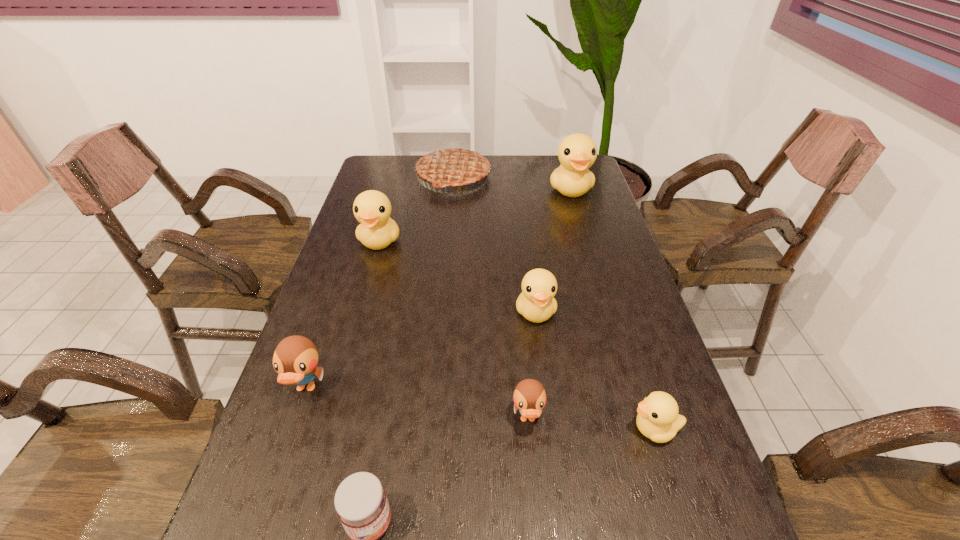
Find the location of `empty space between the second farthest duck and the smaller blue duck`. empty space between the second farthest duck and the smaller blue duck is located at coordinates (454, 330).

Locate an element on the screen. Image resolution: width=960 pixels, height=540 pixels. unoccupied area between the second nearest yellow duck and the nearest yellow duck is located at coordinates point(595,370).

Where is `vacant space that's between the third smallest yellow duck and the smallest yellow duck`? The width and height of the screenshot is (960, 540). vacant space that's between the third smallest yellow duck and the smallest yellow duck is located at coordinates point(517,335).

Find the location of `object that is the fourth nearest to the pie`. object that is the fourth nearest to the pie is located at coordinates (295, 359).

I want to click on object identified as the seventh closest to the right blue duck, so click(x=455, y=165).

Locate which duck ranks fifth in proximity to the red jam. Please provide its 2D coordinates. Your answer should be formatted as a tuple, i.e. [(x, y)], where the tuple contains the x and y coordinates of a point satisfying the conditions above.

[(372, 208)]

Identify the location of duck that stands as the fifth closest to the pie. (529, 397).

Find the location of `yellow duck that is the third nearest to the jam`. yellow duck that is the third nearest to the jam is located at coordinates (372, 208).

At what (x,y) coordinates should I click in order to perform the action: click on yellow duck that is the second closest to the nearest yellow duck. Please return your answer as a coordinate pair (x, y). The height and width of the screenshot is (540, 960). Looking at the image, I should click on (372, 208).